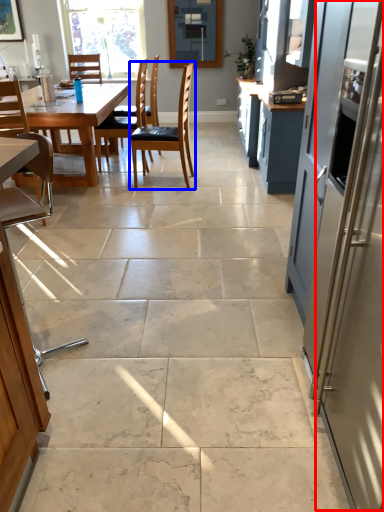
Question: Which object is closer to the camera taking this photo, screen door (highlighted by a red box) or chair (highlighted by a blue box)?

Choices:
 (A) screen door
 (B) chair

Answer: (A)